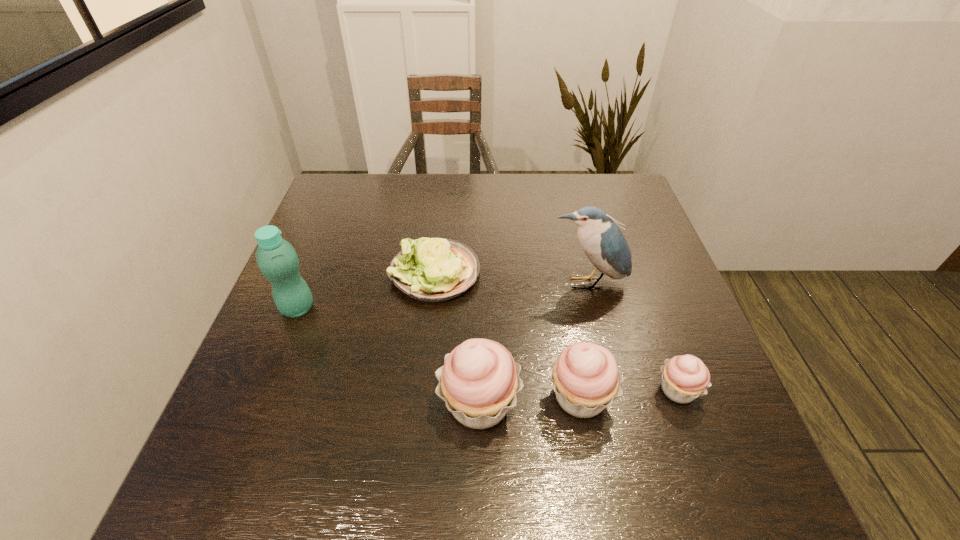
Locate an element on the screen. This screenshot has width=960, height=540. free space located 0.320m on the left of the rightmost cupcake is located at coordinates (492, 390).

This screenshot has height=540, width=960. I want to click on vacant space located on the right of the shortest object, so click(x=624, y=273).

Image resolution: width=960 pixels, height=540 pixels. I want to click on blank space located 0.310m at the tip of the bird's beak, so click(619, 414).

You are a GUI agent. You are given a task and a screenshot of the screen. Output one action in this format:
    pyautogui.click(x=<x>, y=<y>)
    Task: Click on the vacant space situated 0.240m at the front cap of the leftmost object
    The width and height of the screenshot is (960, 540).
    Given the screenshot: What is the action you would take?
    pyautogui.click(x=420, y=308)

Where is `object positioned at the left edge`? The image size is (960, 540). object positioned at the left edge is located at coordinates (276, 258).

The image size is (960, 540). I want to click on cupcake at the right edge, so click(x=684, y=378).

The image size is (960, 540). I want to click on bird present at the right edge, so click(604, 244).

Find the location of a particular element. This screenshot has width=960, height=540. object present at the near right corner is located at coordinates (684, 378).

In the image, there is a desktop. Where is `free space at the far edge`? This screenshot has width=960, height=540. free space at the far edge is located at coordinates (547, 189).

I want to click on vacant space at the near edge, so click(x=459, y=440).